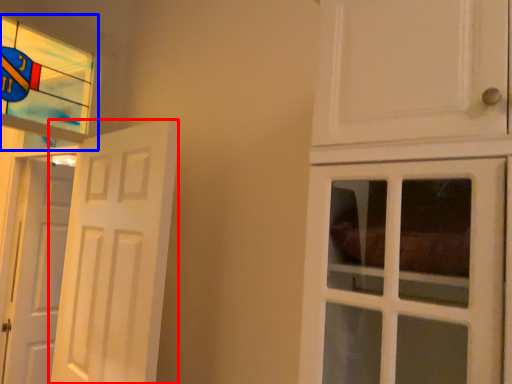
Question: Which object is closer to the camera taking this photo, door (highlighted by a red box) or window (highlighted by a blue box)?

Choices:
 (A) door
 (B) window

Answer: (A)